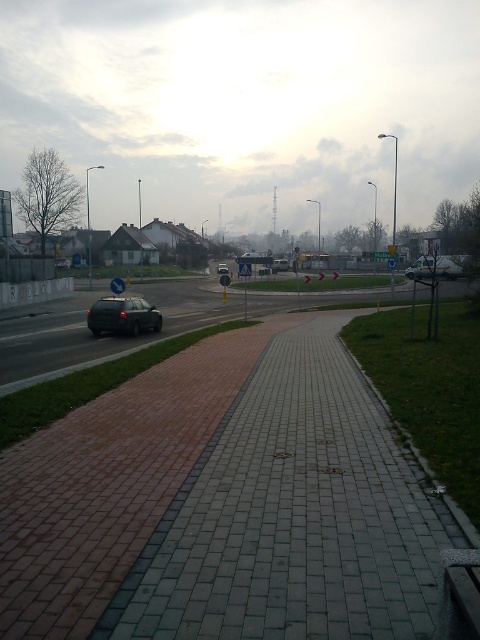
How distant is brick paved sidewalk at center from satin black car at center?

A distance of 49.29 feet exists between brick paved sidewalk at center and satin black car at center.

Can you confirm if brick paved sidewalk at center is smaller than satin black car at center?

No.

Does point (219, 566) come farther from viewer compared to point (124, 314)?

No, (219, 566) is in front of (124, 314).

This screenshot has width=480, height=640. What are the coordinates of `brick paved sidewalk at center` in the screenshot? It's located at (224, 502).

Is brick paved sidewalk at center closer to the viewer compared to matte black car at center?

Yes.

Who is taller, brick paved sidewalk at center or matte black car at center?

Standing taller between the two is matte black car at center.

The height and width of the screenshot is (640, 480). What do you see at coordinates (224, 502) in the screenshot?
I see `brick paved sidewalk at center` at bounding box center [224, 502].

I want to click on brick paved sidewalk at center, so click(x=224, y=502).

In the scene shown: Is brick paved sidewalk at center below metallic silver car at center?

Correct, brick paved sidewalk at center is located below metallic silver car at center.

Is point (252, 472) behind point (443, 260)?

No.

Which is in front, point (231, 442) or point (442, 262)?

Positioned in front is point (231, 442).

Image resolution: width=480 pixels, height=640 pixels. In order to click on brick paved sidewalk at center in this screenshot , I will do `click(224, 502)`.